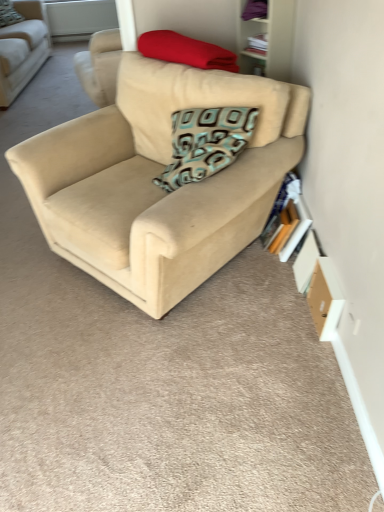
Question: Is hardcover book at right bigger or smaller than teal patterned pillow at upper center, which is counted as the second pillow, starting from the right?

Choices:
 (A) big
 (B) small

Answer: (B)

Question: Considering the positions of hardcover book at right and teal patterned pillow at upper center, which ranks as the 2th pillow in front-to-back order, in the image, is hardcover book at right wider or thinner than teal patterned pillow at upper center, which ranks as the 2th pillow in front-to-back order,?

Choices:
 (A) thin
 (B) wide

Answer: (A)

Question: Estimate the real-world distances between objects in this image. Which object is closer to the beige fabric couch at center, which appears as the 2th studio couch when viewed from the left?

Choices:
 (A) wooden bookshelf at upper right
 (B) beige fabric couch at center, the second studio couch from the bottom
 (C) white plastic window screen at upper center
 (D) teal patterned pillow at upper center, which is counted as the second pillow, starting from the right
 (E) matte red blanket at upper center, which ranks as the first pillow in bottom-to-top order

Answer: (E)

Question: Considering the real-world distances, which object is closest to the beige fabric couch at center, placed as the second studio couch when sorted from right to left?

Choices:
 (A) white plastic window screen at upper center
 (B) teal patterned pillow at upper center, the first pillow when ordered from left to right
 (C) wooden bookshelf at upper right
 (D) hardcover book at right
 (E) beige fabric couch at center, which appears as the 2th studio couch when viewed from the left

Answer: (B)